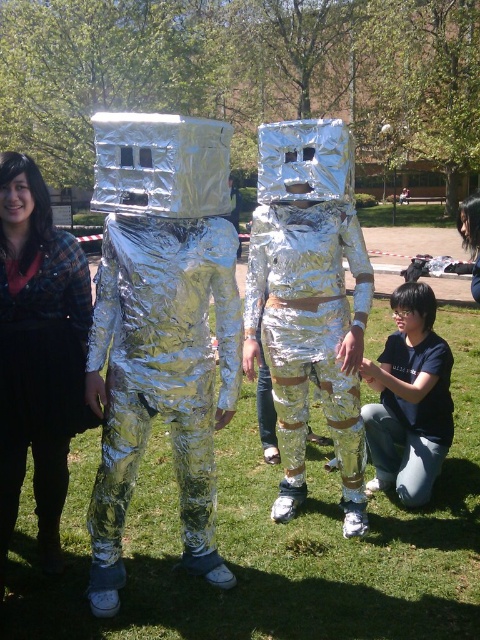
Question: Where is green grass at center located in relation to shiny metallic suit at center in the image?

Choices:
 (A) right
 (B) left

Answer: (A)

Question: Which object is the farthest from the shiny metallic astronaut at center?

Choices:
 (A) black matte shirt at lower right
 (B) brushed metal jacket at upper left

Answer: (B)

Question: Is brushed metal jacket at upper left bigger than black matte shirt at lower right?

Choices:
 (A) yes
 (B) no

Answer: (A)

Question: Does shiny metallic suit at center appear over shiny metallic astronaut at center?

Choices:
 (A) yes
 (B) no

Answer: (B)

Question: Which point is closer to the camera?

Choices:
 (A) black matte shirt at lower right
 (B) green grass at center

Answer: (B)

Question: Which is nearer to the shiny metallic astronaut at center?

Choices:
 (A) green grass at center
 (B) shiny metallic suit at center
 (C) brushed metal jacket at upper left
 (D) black matte shirt at lower right

Answer: (D)